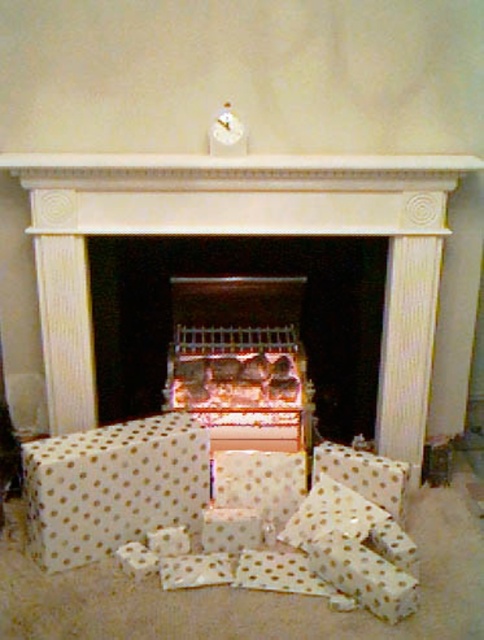
Who is more forward, (71,356) or (112,292)?

Point (71,356) is in front.

Is white marble fireplace at center taller than wooden fireplace at center?

Indeed, white marble fireplace at center has a greater height compared to wooden fireplace at center.

At what (x,y) coordinates should I click in order to perform the action: click on white marble fireplace at center. Please return your answer as a coordinate pair (x, y). The image size is (484, 640). Looking at the image, I should click on (242, 234).

Is white marble fireplace at center thinner than white marble fireplace at upper center?

Yes, white marble fireplace at center is thinner than white marble fireplace at upper center.

Is white marble fireplace at center to the right of white marble fireplace at upper center from the viewer's perspective?

No, white marble fireplace at center is not to the right of white marble fireplace at upper center.

Who is more distant from viewer, (x=253, y=180) or (x=75, y=154)?

Point (x=253, y=180)

At what (x,y) coordinates should I click in order to perform the action: click on white marble fireplace at center. Please return your answer as a coordinate pair (x, y). Looking at the image, I should click on (242, 234).

What are the coordinates of `wooden fireplace at center` in the screenshot? It's located at (240, 317).

Consider the image. Who is more forward, (330, 328) or (97, 516)?

Point (97, 516) is more forward.

Where is `wooden fireplace at center`? This screenshot has width=484, height=640. wooden fireplace at center is located at coordinates (240, 317).